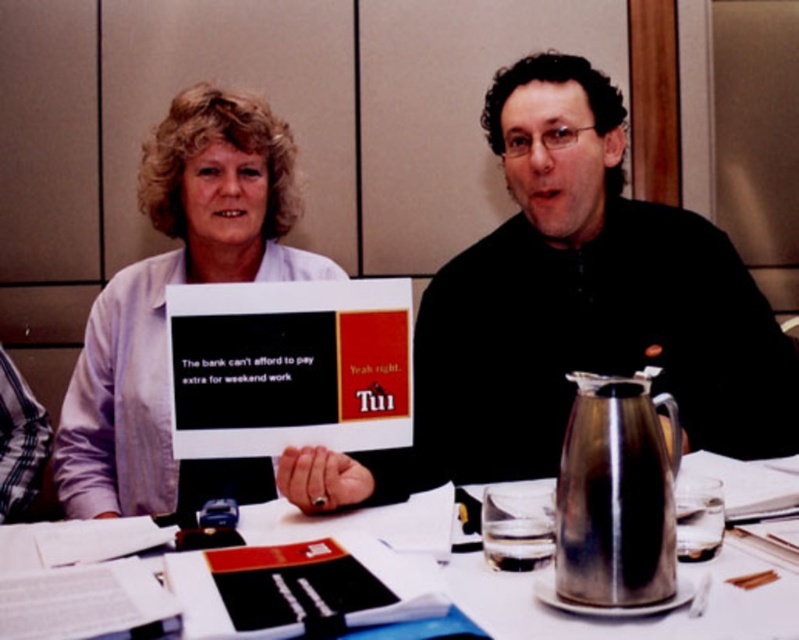
Question: Which point appears farthest from the camera in this image?

Choices:
 (A) (237, 212)
 (B) (483, 572)
 (C) (722, 252)

Answer: (A)

Question: Can you confirm if black matte sign at center is positioned above matte white shirt at center?

Choices:
 (A) no
 (B) yes

Answer: (A)

Question: Estimate the real-world distances between objects in this image. Which object is closer to the matte white shirt at center?

Choices:
 (A) white paper at center
 (B) black matte sign at center

Answer: (B)

Question: In this image, where is black matte sign at center located relative to matte white shirt at center?

Choices:
 (A) left
 (B) right

Answer: (B)

Question: Which of the following is the closest to the observer?

Choices:
 (A) matte white shirt at center
 (B) black matte sign at center

Answer: (B)

Question: Can you confirm if matte white shirt at center is thinner than white paper at center?

Choices:
 (A) no
 (B) yes

Answer: (B)